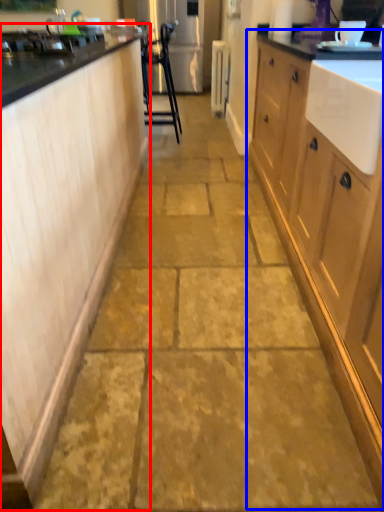
Question: Which point is further to the camera, cabinetry (highlighted by a red box) or cabinetry (highlighted by a blue box)?

Choices:
 (A) cabinetry
 (B) cabinetry

Answer: (A)